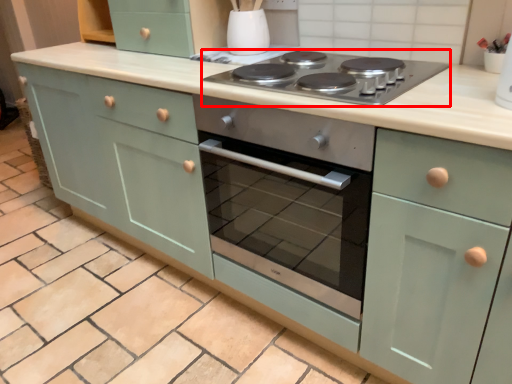
Question: From the image's perspective, where is gas stove (annotated by the red box) located relative to appliance?

Choices:
 (A) below
 (B) above

Answer: (A)